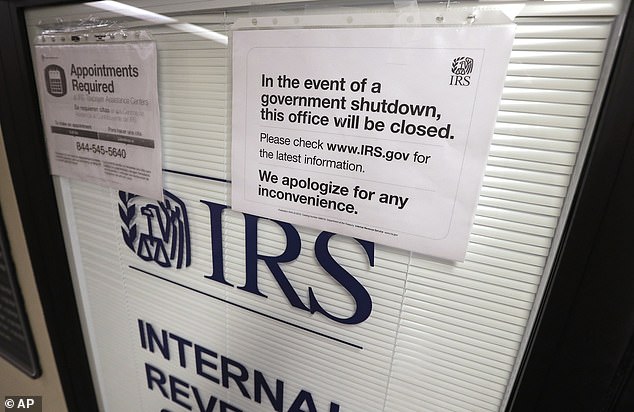
At what (x,y) coordinates should I click in order to perform the action: click on beige wall. Please return your answer as a coordinate pair (x, y). Looking at the image, I should click on (47, 382).